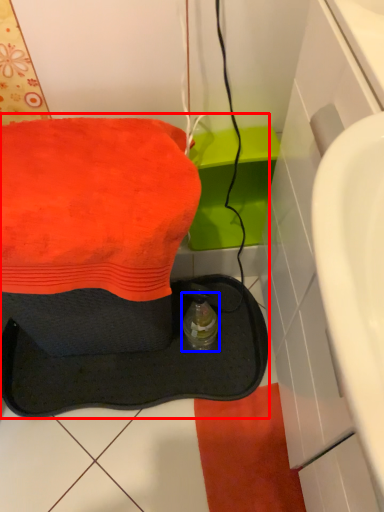
Question: Which point is closer to the camera, sink (highlighted by a red box) or bottle (highlighted by a blue box)?

Choices:
 (A) sink
 (B) bottle

Answer: (A)